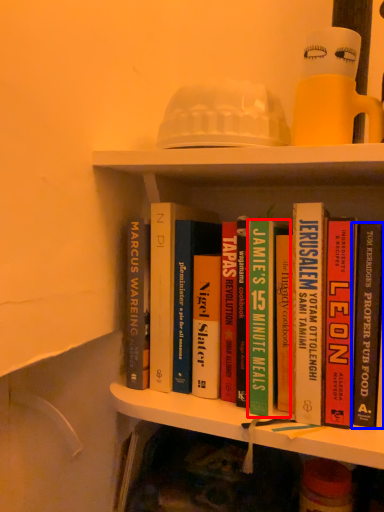
Question: Which of the following is the closest to the observer, book (highlighted by a red box) or book (highlighted by a blue box)?

Choices:
 (A) book
 (B) book

Answer: (B)